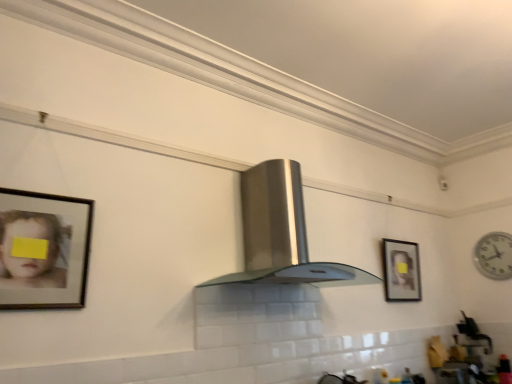
Where is `wooden framed portrait at left, the first picture frame viewed from the front`? Image resolution: width=512 pixels, height=384 pixels. wooden framed portrait at left, the first picture frame viewed from the front is located at coordinates (42, 250).

What do you see at coordinates (281, 233) in the screenshot? I see `stainless steel fume hood at center` at bounding box center [281, 233].

This screenshot has width=512, height=384. Identify the location of white glossy sink at lower right. point(469,358).

How many degrees apart are the facing directions of wooden framed portrait at center right, which appears as the second picture frame when viewed from the left, and white plastic clock at right?

90.1 degrees separate the facing orientations of wooden framed portrait at center right, which appears as the second picture frame when viewed from the left, and white plastic clock at right.

Is wooden framed portrait at center right, the second picture frame from the front, bigger than white plastic clock at right?

Yes, wooden framed portrait at center right, the second picture frame from the front, is bigger than white plastic clock at right.

Based on the photo, is white plastic clock at right a part of wooden framed portrait at center right, the second picture frame from the front?

No, wooden framed portrait at center right, the second picture frame from the front, does not contain white plastic clock at right.

Is wooden framed portrait at center right, the second picture frame from the front, touching white plastic clock at right?

No, wooden framed portrait at center right, the second picture frame from the front, is not with white plastic clock at right.

Is white glossy sink at lower right at the left side of wooden framed portrait at center right, the second picture frame from the front?

No.

Between white glossy sink at lower right and wooden framed portrait at center right, acting as the first picture frame starting from the right, which one is positioned in front?

wooden framed portrait at center right, acting as the first picture frame starting from the right, is more forward.

The width and height of the screenshot is (512, 384). In order to click on the 1st picture frame to the left when counting from the white glossy sink at lower right in this screenshot , I will do [x=401, y=270].

Is white glossy sink at lower right facing towards wooden framed portrait at center right, the second picture frame from the front?

No, white glossy sink at lower right does not turn towards wooden framed portrait at center right, the second picture frame from the front.

From a real-world perspective, is wooden framed portrait at center right, placed as the 1th picture frame when sorted from back to front, located beneath white glossy sink at lower right?

No, from a real-world perspective, wooden framed portrait at center right, placed as the 1th picture frame when sorted from back to front, is not under white glossy sink at lower right.

Could you tell me if wooden framed portrait at center right, the second picture frame from the front, is facing white glossy sink at lower right?

No, wooden framed portrait at center right, the second picture frame from the front, does not turn towards white glossy sink at lower right.

Is wooden framed portrait at center right, which appears as the second picture frame when viewed from the left, not within white glossy sink at lower right?

Yes, wooden framed portrait at center right, which appears as the second picture frame when viewed from the left, is outside of white glossy sink at lower right.

Considering the relative positions of wooden framed portrait at center right, acting as the first picture frame starting from the right, and white glossy sink at lower right in the image provided, is wooden framed portrait at center right, acting as the first picture frame starting from the right, to the right of white glossy sink at lower right from the viewer's perspective?

No, wooden framed portrait at center right, acting as the first picture frame starting from the right, is not to the right of white glossy sink at lower right.

Is stainless steel fume hood at center far away from white plastic clock at right?

Yes, stainless steel fume hood at center and white plastic clock at right are located far from each other.

From the image's perspective, between stainless steel fume hood at center and white plastic clock at right, who is located below?

white plastic clock at right appears lower in the image.

Consider the image. How far apart are stainless steel fume hood at center and white plastic clock at right?

stainless steel fume hood at center and white plastic clock at right are 2.11 meters apart from each other.

From the image's perspective, which object appears higher, wooden framed portrait at left, the second picture frame positioned from the back, or white glossy sink at lower right?

wooden framed portrait at left, the second picture frame positioned from the back, is shown above in the image.

From a real-world perspective, is wooden framed portrait at left, which appears as the 2th picture frame when viewed from the right, below white glossy sink at lower right?

No, from a real-world perspective, wooden framed portrait at left, which appears as the 2th picture frame when viewed from the right, is not under white glossy sink at lower right.

Is wooden framed portrait at left, the second picture frame positioned from the back, beside white glossy sink at lower right?

They are not placed beside each other.

Locate an element on the screen. The height and width of the screenshot is (384, 512). picture frame that is the 2nd one when counting leftward from the white glossy sink at lower right is located at coordinates (42, 250).

Which of these two, white glossy sink at lower right or stainless steel fume hood at center, is bigger?

stainless steel fume hood at center is bigger.

Could you tell me if white glossy sink at lower right is facing stainless steel fume hood at center?

No, white glossy sink at lower right is not turned towards stainless steel fume hood at center.

Considering the relative positions of white glossy sink at lower right and stainless steel fume hood at center in the image provided, is white glossy sink at lower right to the left or to the right of stainless steel fume hood at center?

Based on their positions, white glossy sink at lower right is located to the right of stainless steel fume hood at center.

Considering the relative sizes of white plastic clock at right and wooden framed portrait at center right, acting as the first picture frame starting from the right, in the image provided, is white plastic clock at right wider than wooden framed portrait at center right, acting as the first picture frame starting from the right,?

In fact, white plastic clock at right might be narrower than wooden framed portrait at center right, acting as the first picture frame starting from the right.

How distant is white plastic clock at right from wooden framed portrait at center right, placed as the 1th picture frame when sorted from back to front?

white plastic clock at right is 3.29 feet away from wooden framed portrait at center right, placed as the 1th picture frame when sorted from back to front.

From a real-world perspective, between white plastic clock at right and wooden framed portrait at center right, which appears as the second picture frame when viewed from the left, who is vertically higher?

white plastic clock at right, from a real-world perspective.

Looking at this image, is white plastic clock at right positioned beyond the bounds of wooden framed portrait at center right, acting as the first picture frame starting from the right?

Yes, white plastic clock at right is outside of wooden framed portrait at center right, acting as the first picture frame starting from the right.

Image resolution: width=512 pixels, height=384 pixels. Find the location of `clock behind the wooden framed portrait at center right, the second picture frame from the front`. clock behind the wooden framed portrait at center right, the second picture frame from the front is located at coordinates (494, 255).

Which picture frame is the 1st one when counting from the left side of the white glossy sink at lower right? Please provide its 2D coordinates.

[(401, 270)]

Considering their positions, is stainless steel fume hood at center positioned further to white glossy sink at lower right than wooden framed portrait at center right, placed as the 1th picture frame when sorted from back to front?

stainless steel fume hood at center is positioned further to the anchor white glossy sink at lower right.

Looking at the image, which one is located further to white glossy sink at lower right, wooden framed portrait at left, the first picture frame viewed from the front, or stainless steel fume hood at center?

Among the two, wooden framed portrait at left, the first picture frame viewed from the front, is located further to white glossy sink at lower right.

Looking at the image, which one is located closer to stainless steel fume hood at center, white glossy sink at lower right or wooden framed portrait at center right, acting as the first picture frame starting from the right?

wooden framed portrait at center right, acting as the first picture frame starting from the right, is positioned closer to the anchor stainless steel fume hood at center.

Based on their spatial positions, is wooden framed portrait at center right, placed as the 1th picture frame when sorted from back to front, or white glossy sink at lower right closer to stainless steel fume hood at center?

wooden framed portrait at center right, placed as the 1th picture frame when sorted from back to front, is positioned closer to the anchor stainless steel fume hood at center.

Based on their spatial positions, is wooden framed portrait at left, the first picture frame viewed from the front, or wooden framed portrait at center right, the second picture frame from the front, closer to white plastic clock at right?

wooden framed portrait at center right, the second picture frame from the front, is closer to white plastic clock at right.

Consider the image. Looking at the image, which one is located further to stainless steel fume hood at center, wooden framed portrait at left, which appears as the 2th picture frame when viewed from the right, or white plastic clock at right?

white plastic clock at right.

From the image, which object appears to be farther from wooden framed portrait at left, the second picture frame positioned from the back, wooden framed portrait at center right, placed as the 1th picture frame when sorted from back to front, or white plastic clock at right?

white plastic clock at right.

Considering their positions, is wooden framed portrait at center right, placed as the 1th picture frame when sorted from back to front, positioned further to white glossy sink at lower right than wooden framed portrait at left, which appears as the 2th picture frame when viewed from the right?

wooden framed portrait at left, which appears as the 2th picture frame when viewed from the right, is further to white glossy sink at lower right.

Identify the location of picture frame between stainless steel fume hood at center and white glossy sink at lower right from left to right. The width and height of the screenshot is (512, 384). (401, 270).

Identify the location of sink between wooden framed portrait at left, which appears as the 2th picture frame when viewed from the right, and white plastic clock at right. This screenshot has width=512, height=384. (469, 358).

Identify the location of sink situated between wooden framed portrait at center right, placed as the 1th picture frame when sorted from back to front, and white plastic clock at right from left to right. (469, 358).

What are the coordinates of `picture frame between stainless steel fume hood at center and white plastic clock at right in the horizontal direction` in the screenshot? It's located at (401, 270).